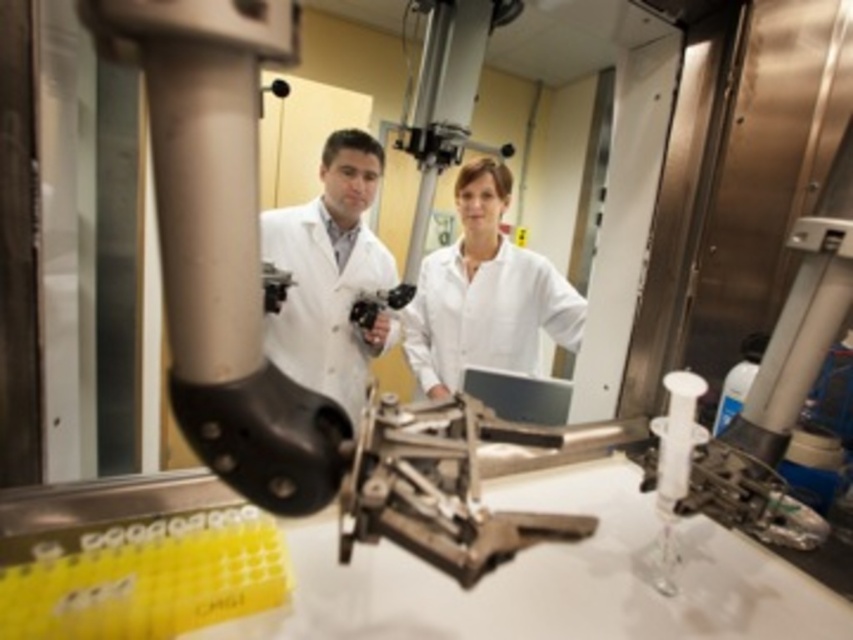
Based on the photo, you are a new lab assistant who needs to move a 12 inch long tool from the white lab coat at center to the white matte lab coat at center. Is there enough space between them to slide the tool without moving either coat?

The white lab coat at center and the white matte lab coat at center are 10.92 inches apart. Since the tool is 12 inches long, which is longer than the space between them, you cannot slide the tool without moving either coat.

You are a researcher in the lab and need to choose a lab coat to wear. There are two options available in the image. Which one is larger in size between the white lab coat at center and the white matte lab coat at center?

The white lab coat at center is bigger than the white matte lab coat at center, so you should choose the white lab coat at center if you need a larger size.

You are a visitor in the lab and need to approach the robotic arm to ask a question. Which lab coat should you walk towards first, the white lab coat at center or the white matte lab coat at center?

You should walk towards the white lab coat at center first because it is closer to you than the white matte lab coat at center.